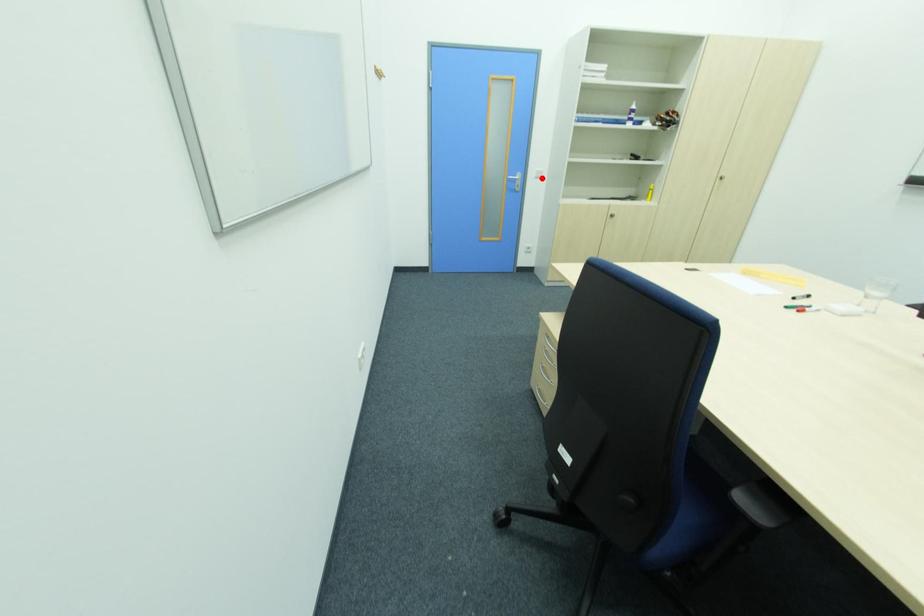
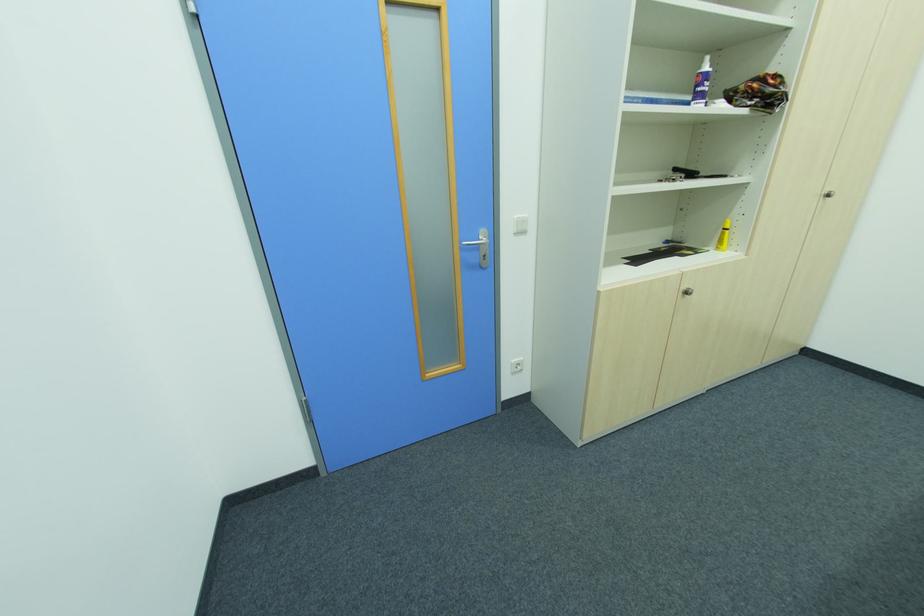
Question: I am providing you with two images of the same scene from different viewpoints. Image1 has a red point marked. In image2, the corresponding 3D location appears at what relative position? Reply with the corresponding letter.

Choices:
 (A) Closer
 (B) Farther

Answer: (B)